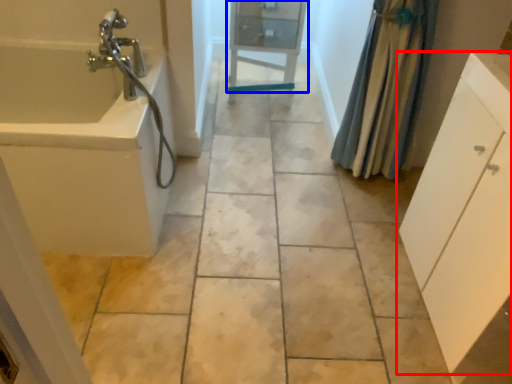
Question: Among these objects, which one is farthest to the camera, bathroom cabinet (highlighted by a red box) or cabinetry (highlighted by a blue box)?

Choices:
 (A) bathroom cabinet
 (B) cabinetry

Answer: (B)